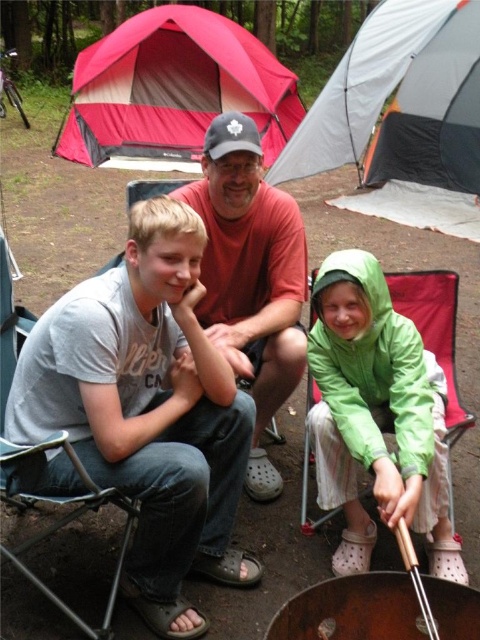
Can you confirm if gray fabric tent at upper center is shorter than red/gray tent at upper left?

Incorrect, gray fabric tent at upper center's height does not fall short of red/gray tent at upper left's.

Is gray fabric tent at upper center to the right of red/gray tent at upper left from the viewer's perspective?

Yes, gray fabric tent at upper center is to the right of red/gray tent at upper left.

Is point (407, 22) less distant than point (170, 28)?

Yes.

This screenshot has height=640, width=480. I want to click on gray fabric tent at upper center, so click(402, 116).

Can you confirm if gray cotton t-shirt at center is positioned to the left of red/gray tent at upper left?

In fact, gray cotton t-shirt at center is to the right of red/gray tent at upper left.

Which is in front, point (12, 397) or point (253, 68)?

Point (12, 397) is more forward.

I want to click on gray cotton t-shirt at center, so click(x=147, y=410).

Between gray fabric tent at upper center and green matte raincoat at center, which one is positioned lower?

green matte raincoat at center

Who is higher up, gray fabric tent at upper center or green matte raincoat at center?

gray fabric tent at upper center

The width and height of the screenshot is (480, 640). I want to click on gray fabric tent at upper center, so click(402, 116).

At what (x,y) coordinates should I click in order to perform the action: click on gray fabric tent at upper center. Please return your answer as a coordinate pair (x, y). Image resolution: width=480 pixels, height=640 pixels. Looking at the image, I should click on (402, 116).